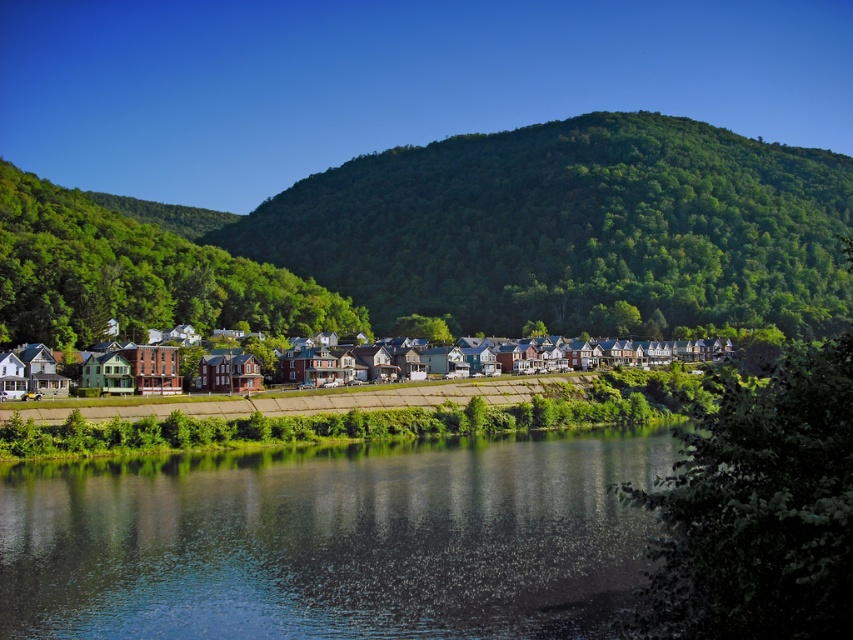
Which of these two, smooth reflective water at center or multicolored brick houses at center, stands taller?

With more height is smooth reflective water at center.

Is smooth reflective water at center bigger than multicolored brick houses at center?

No.

Is point (334, 588) less distant than point (438, 348)?

Yes, it is.

In order to click on smooth reflective water at center in this screenshot , I will do `click(332, 540)`.